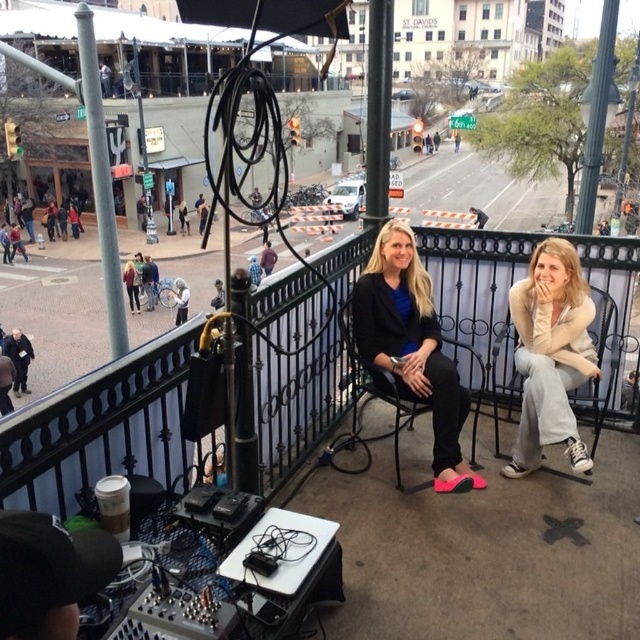
Which is more to the left, matte black blazer at center or white fabric umbrella at upper center?

white fabric umbrella at upper center is more to the left.

Does matte black blazer at center have a smaller size compared to white fabric umbrella at upper center?

Indeed, matte black blazer at center has a smaller size compared to white fabric umbrella at upper center.

Which is behind, point (404, 237) or point (180, 280)?

Positioned behind is point (180, 280).

Identify the location of matte black blazer at center. (412, 346).

Between black wrought iron railing at center and matte black blazer at center, which one has less height?

black wrought iron railing at center

Who is more distant from viewer, (308, 358) or (432, 385)?

The point (308, 358) is more distant.

The height and width of the screenshot is (640, 640). I want to click on black wrought iron railing at center, so click(102, 428).

This screenshot has height=640, width=640. I want to click on black wrought iron railing at center, so click(x=102, y=428).

Is black wrought iron railing at center above light beige sweater at center?

No.

Can you confirm if black wrought iron railing at center is bigger than light beige sweater at center?

Indeed, black wrought iron railing at center has a larger size compared to light beige sweater at center.

Identify the location of black wrought iron railing at center. This screenshot has width=640, height=640. (102, 428).